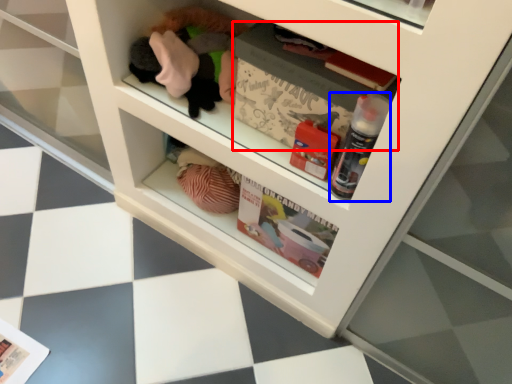
Question: Which object is further to the camera taking this photo, magazine (highlighted by a red box) or bottle (highlighted by a blue box)?

Choices:
 (A) magazine
 (B) bottle

Answer: (A)